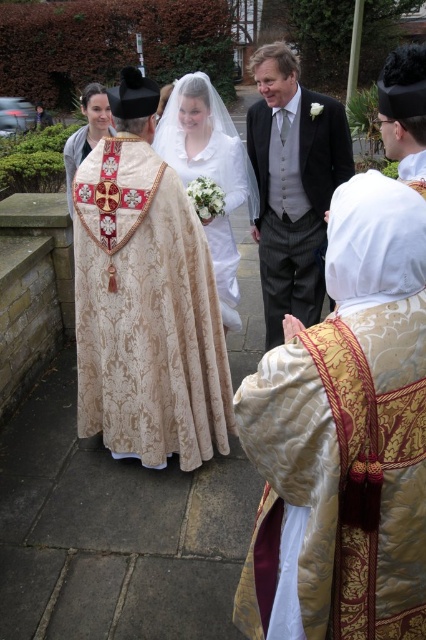
Question: Which point is closer to the camera taking this photo?

Choices:
 (A) (224, 230)
 (B) (83, 90)

Answer: (A)

Question: Can you confirm if dark gray suit at center is positioned above white satin dress at center?

Choices:
 (A) yes
 (B) no

Answer: (A)

Question: Which point is farther to the camera?

Choices:
 (A) gold brocade dress at center
 (B) dark gray suit at center

Answer: (B)

Question: Is gold brocade robe at center smaller than dark gray suit at center?

Choices:
 (A) yes
 (B) no

Answer: (A)

Question: Which of these objects is positioned closest to the gold brocade robe at center?

Choices:
 (A) white satin dress at center
 (B) matte gold vestment at center
 (C) dark gray suit at center
 (D) gold brocade dress at center

Answer: (A)

Question: Does gold brocade robe at center appear over dark gray suit at center?

Choices:
 (A) no
 (B) yes

Answer: (A)